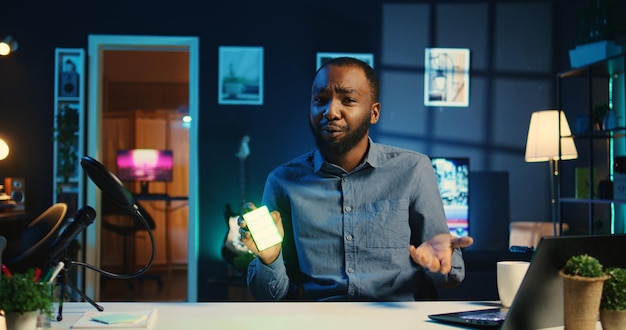
Locate an element on the screen. wall art is located at coordinates tap(227, 77), tap(447, 72), tap(369, 55).